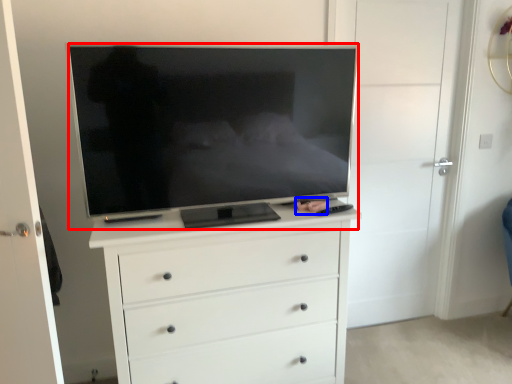
Question: Which of the following is the farthest to the observer, television (highlighted by a red box) or person (highlighted by a blue box)?

Choices:
 (A) television
 (B) person

Answer: (B)